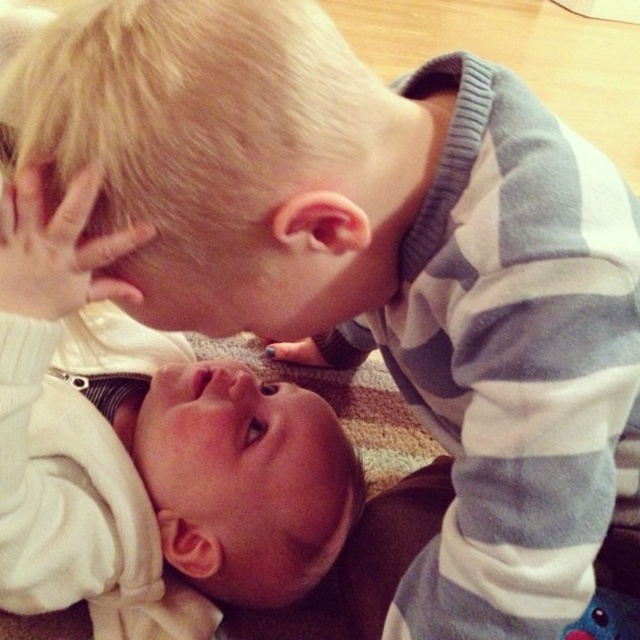
Which is more to the right, white soft baby at center or blonde hair at upper center?

From the viewer's perspective, blonde hair at upper center appears more on the right side.

Which is more to the left, white soft baby at center or blonde hair at upper center?

From the viewer's perspective, white soft baby at center appears more on the left side.

Does point (216, 397) come closer to viewer compared to point (312, 54)?

No, (216, 397) is further to viewer.

Image resolution: width=640 pixels, height=640 pixels. Find the location of `white soft baby at center`. white soft baby at center is located at coordinates (145, 449).